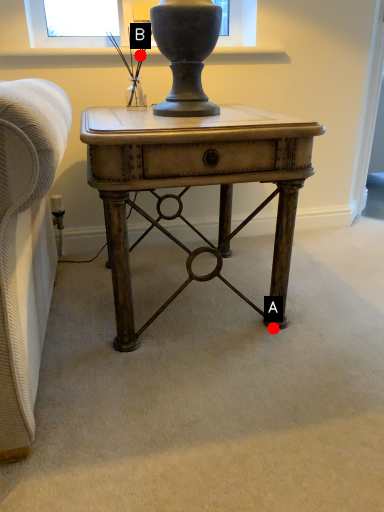
Question: Two points are circled on the image, labeled by A and B beside each circle. Which of the following is the closest to the observer?

Choices:
 (A) A is closer
 (B) B is closer

Answer: (A)